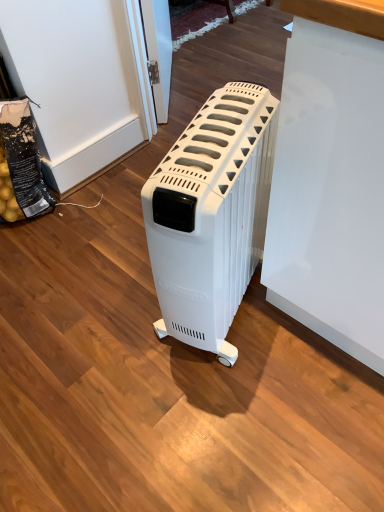
Where is `white plastic heater at center`? white plastic heater at center is located at coordinates (211, 215).

Describe the element at coordinates (211, 215) in the screenshot. The width and height of the screenshot is (384, 512). I see `white plastic heater at center` at that location.

Measure the distance between white plastic heater at center and camera.

They are 30.00 inches apart.

What are the coordinates of `white plastic heater at center` in the screenshot? It's located at (211, 215).